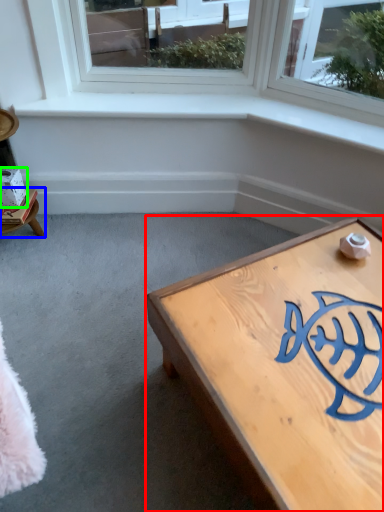
Question: Which object is positioned closest to coffee table (highlighted by a red box)? Select from furniture (highlighted by a blue box) and box (highlighted by a green box).

Choices:
 (A) furniture
 (B) box

Answer: (A)